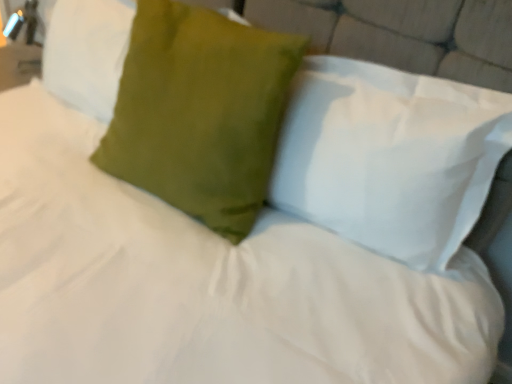
Question: Does matte green pillow at upper center, the first pillow in the right-to-left sequence, turn towards satin green pillow at center, the second pillow from the left?

Choices:
 (A) yes
 (B) no

Answer: (B)

Question: Is matte green pillow at upper center, the first pillow in the right-to-left sequence, at the left side of satin green pillow at center, the second pillow from the left?

Choices:
 (A) yes
 (B) no

Answer: (B)

Question: Can you confirm if matte green pillow at upper center, the first pillow in the right-to-left sequence, is thinner than satin green pillow at center, which ranks as the second pillow in right-to-left order?

Choices:
 (A) yes
 (B) no

Answer: (A)

Question: From the image's perspective, is matte green pillow at upper center, which appears as the third pillow when viewed from the left, on top of satin green pillow at center, which ranks as the second pillow in right-to-left order?

Choices:
 (A) no
 (B) yes

Answer: (A)

Question: From a real-world perspective, is matte green pillow at upper center, which appears as the third pillow when viewed from the left, on top of satin green pillow at center, which ranks as the second pillow in right-to-left order?

Choices:
 (A) no
 (B) yes

Answer: (B)

Question: Is point (296, 135) positioned closer to the camera than point (108, 46)?

Choices:
 (A) closer
 (B) farther

Answer: (A)

Question: In the image, is matte green pillow at upper center, which appears as the third pillow when viewed from the left, positioned in front of or behind satin green pillow at upper left, which is the third pillow in right-to-left order?

Choices:
 (A) behind
 (B) front

Answer: (B)

Question: From a real-world perspective, is matte green pillow at upper center, the first pillow in the right-to-left sequence, above or below satin green pillow at upper left, the 1th pillow from the left?

Choices:
 (A) above
 (B) below

Answer: (A)

Question: Is matte green pillow at upper center, the first pillow in the right-to-left sequence, situated inside satin green pillow at upper left, the 1th pillow from the left, or outside?

Choices:
 (A) inside
 (B) outside

Answer: (B)

Question: From a real-world perspective, is satin green pillow at center, which ranks as the second pillow in right-to-left order, positioned above or below matte green pillow at upper center, which appears as the third pillow when viewed from the left?

Choices:
 (A) below
 (B) above

Answer: (A)

Question: Is satin green pillow at center, which ranks as the second pillow in right-to-left order, wider or thinner than matte green pillow at upper center, which appears as the third pillow when viewed from the left?

Choices:
 (A) thin
 (B) wide

Answer: (B)

Question: Is satin green pillow at center, which ranks as the second pillow in right-to-left order, situated inside matte green pillow at upper center, which appears as the third pillow when viewed from the left, or outside?

Choices:
 (A) inside
 (B) outside

Answer: (B)

Question: Considering the positions of satin green pillow at center, the second pillow from the left, and matte green pillow at upper center, which appears as the third pillow when viewed from the left, in the image, is satin green pillow at center, the second pillow from the left, taller or shorter than matte green pillow at upper center, which appears as the third pillow when viewed from the left,?

Choices:
 (A) short
 (B) tall

Answer: (B)

Question: Is matte green pillow at upper center, the first pillow in the right-to-left sequence, in front of or behind satin green pillow at center, which ranks as the second pillow in right-to-left order, in the image?

Choices:
 (A) behind
 (B) front

Answer: (B)

Question: Is point (311, 59) closer or farther from the camera than point (207, 39)?

Choices:
 (A) farther
 (B) closer

Answer: (A)